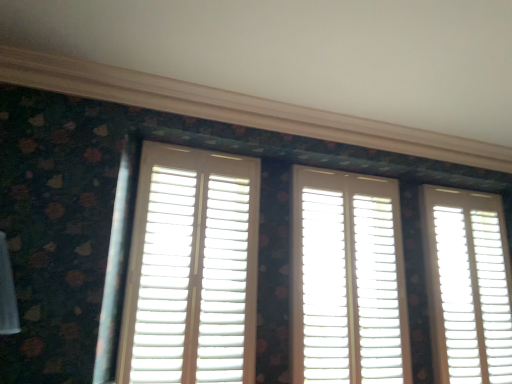
How much space does white wood shutters at center, marked as the 2th window in a right-to-left arrangement, occupy horizontally?

white wood shutters at center, marked as the 2th window in a right-to-left arrangement, is 6.44 inches wide.

Locate an element on the screen. The width and height of the screenshot is (512, 384). white wood shutters at center, marked as the 2th window in a right-to-left arrangement is located at coordinates (348, 280).

Locate an element on the screen. white matte shutters at center, which is the third window in right-to-left order is located at coordinates click(x=192, y=269).

Can you confirm if white matte shutter at right, the first window positioned from the right, is smaller than white matte shutters at center, which is the third window in right-to-left order?

No.

Is white matte shutter at right, acting as the 3th window starting from the left, behind white matte shutters at center, which is the third window in right-to-left order?

Yes.

Is point (454, 377) more distant than point (168, 298)?

Yes, it is.

You are a GUI agent. You are given a task and a screenshot of the screen. Output one action in this format:
    pyautogui.click(x=<x>, y=<y>)
    Task: Click on the window that is the 2nd one when counting backward from the white matte shutters at center, which is the third window in right-to-left order
    The image size is (512, 384).
    Given the screenshot: What is the action you would take?
    pyautogui.click(x=467, y=285)

Can you see white wood shutters at center, marked as the 2th window in a right-to-left arrangement, touching white matte shutter at right, acting as the 3th window starting from the left?

No, white wood shutters at center, marked as the 2th window in a right-to-left arrangement, is not beside white matte shutter at right, acting as the 3th window starting from the left.

Between point (369, 210) and point (502, 328), which one is positioned in front?

The point (369, 210) is in front.

Considering the relative positions of white wood shutters at center, the 2th window in the left-to-right sequence, and white matte shutter at right, the first window positioned from the right, in the image provided, is white wood shutters at center, the 2th window in the left-to-right sequence, to the left of white matte shutter at right, the first window positioned from the right, from the viewer's perspective?

Indeed, white wood shutters at center, the 2th window in the left-to-right sequence, is positioned on the left side of white matte shutter at right, the first window positioned from the right.

Is white wood shutters at center, the 2th window in the left-to-right sequence, aimed at white matte shutters at center, which is the third window in right-to-left order?

No, white wood shutters at center, the 2th window in the left-to-right sequence, does not turn towards white matte shutters at center, which is the third window in right-to-left order.

Which of these two, white wood shutters at center, marked as the 2th window in a right-to-left arrangement, or white matte shutters at center, marked as the first window in a left-to-right arrangement, is smaller?

With smaller size is white matte shutters at center, marked as the first window in a left-to-right arrangement.

How different are the orientations of white wood shutters at center, marked as the 2th window in a right-to-left arrangement, and white matte shutters at center, marked as the first window in a left-to-right arrangement, in degrees?

white wood shutters at center, marked as the 2th window in a right-to-left arrangement, and white matte shutters at center, marked as the first window in a left-to-right arrangement, are facing 2.49 degrees away from each other.

Is white wood shutters at center, marked as the 2th window in a right-to-left arrangement, in contact with white matte shutters at center, which is the third window in right-to-left order?

No, white wood shutters at center, marked as the 2th window in a right-to-left arrangement, is not making contact with white matte shutters at center, which is the third window in right-to-left order.

From the image's perspective, is white matte shutters at center, marked as the first window in a left-to-right arrangement, on top of white wood shutters at center, the 2th window in the left-to-right sequence?

Yes, from the image's perspective, white matte shutters at center, marked as the first window in a left-to-right arrangement, is above white wood shutters at center, the 2th window in the left-to-right sequence.

Looking at this image, could you measure the distance between white matte shutters at center, marked as the first window in a left-to-right arrangement, and white wood shutters at center, the 2th window in the left-to-right sequence?

white matte shutters at center, marked as the first window in a left-to-right arrangement, and white wood shutters at center, the 2th window in the left-to-right sequence, are 21.79 inches apart.

Is there a large distance between white matte shutters at center, which is the third window in right-to-left order, and white wood shutters at center, marked as the 2th window in a right-to-left arrangement?

No, white matte shutters at center, which is the third window in right-to-left order, is in close proximity to white wood shutters at center, marked as the 2th window in a right-to-left arrangement.

Is the depth of white matte shutters at center, marked as the first window in a left-to-right arrangement, greater than that of white wood shutters at center, the 2th window in the left-to-right sequence?

No, the depth of white matte shutters at center, marked as the first window in a left-to-right arrangement, is less than that of white wood shutters at center, the 2th window in the left-to-right sequence.

Is point (132, 282) positioned before point (443, 273)?

That is True.

Considering the sizes of objects white matte shutters at center, which is the third window in right-to-left order, and white matte shutter at right, acting as the 3th window starting from the left, in the image provided, who is shorter, white matte shutters at center, which is the third window in right-to-left order, or white matte shutter at right, acting as the 3th window starting from the left,?

white matte shutters at center, which is the third window in right-to-left order.

Is white matte shutters at center, marked as the first window in a left-to-right arrangement, oriented towards white matte shutter at right, the first window positioned from the right?

No, white matte shutters at center, marked as the first window in a left-to-right arrangement, is not turned towards white matte shutter at right, the first window positioned from the right.

From the image's perspective, is white matte shutter at right, the first window positioned from the right, located beneath white wood shutters at center, the 2th window in the left-to-right sequence?

Yes, from the image's perspective, white matte shutter at right, the first window positioned from the right, is beneath white wood shutters at center, the 2th window in the left-to-right sequence.

Is white matte shutter at right, acting as the 3th window starting from the left, far away from white wood shutters at center, marked as the 2th window in a right-to-left arrangement?

No, there isn't a large distance between white matte shutter at right, acting as the 3th window starting from the left, and white wood shutters at center, marked as the 2th window in a right-to-left arrangement.

Considering the relative sizes of white matte shutter at right, acting as the 3th window starting from the left, and white wood shutters at center, the 2th window in the left-to-right sequence, in the image provided, is white matte shutter at right, acting as the 3th window starting from the left, bigger than white wood shutters at center, the 2th window in the left-to-right sequence,?

No.

Looking at this image, considering the relative sizes of white matte shutter at right, acting as the 3th window starting from the left, and white wood shutters at center, marked as the 2th window in a right-to-left arrangement, in the image provided, is white matte shutter at right, acting as the 3th window starting from the left, wider than white wood shutters at center, marked as the 2th window in a right-to-left arrangement,?

No.

From a real-world perspective, starting from the white matte shutter at right, acting as the 3th window starting from the left, which window is the 2nd one vertically above it? Please provide its 2D coordinates.

[(192, 269)]

Locate an element on the screen. window below the white wood shutters at center, the 2th window in the left-to-right sequence (from the image's perspective) is located at coordinates (467, 285).

From the image, which object appears to be nearer to white matte shutters at center, marked as the first window in a left-to-right arrangement, white matte shutter at right, the first window positioned from the right, or white wood shutters at center, the 2th window in the left-to-right sequence?

white wood shutters at center, the 2th window in the left-to-right sequence, is closer to white matte shutters at center, marked as the first window in a left-to-right arrangement.

Considering their positions, is white wood shutters at center, the 2th window in the left-to-right sequence, positioned closer to white matte shutters at center, which is the third window in right-to-left order, than white matte shutter at right, the first window positioned from the right?

Among the two, white wood shutters at center, the 2th window in the left-to-right sequence, is located nearer to white matte shutters at center, which is the third window in right-to-left order.

Estimate the real-world distances between objects in this image. Which object is closer to white matte shutter at right, the first window positioned from the right, white matte shutters at center, marked as the first window in a left-to-right arrangement, or white wood shutters at center, marked as the 2th window in a right-to-left arrangement?

The object closer to white matte shutter at right, the first window positioned from the right, is white wood shutters at center, marked as the 2th window in a right-to-left arrangement.

Which object lies nearer to the anchor point white matte shutter at right, the first window positioned from the right, white wood shutters at center, marked as the 2th window in a right-to-left arrangement, or white matte shutters at center, which is the third window in right-to-left order?

white wood shutters at center, marked as the 2th window in a right-to-left arrangement, is closer to white matte shutter at right, the first window positioned from the right.

When comparing their distances from white wood shutters at center, the 2th window in the left-to-right sequence, does white matte shutter at right, acting as the 3th window starting from the left, or white matte shutters at center, which is the third window in right-to-left order, seem further?

white matte shutters at center, which is the third window in right-to-left order, lies further to white wood shutters at center, the 2th window in the left-to-right sequence, than the other object.

Considering their positions, is white matte shutters at center, marked as the first window in a left-to-right arrangement, positioned closer to white wood shutters at center, the 2th window in the left-to-right sequence, than white matte shutter at right, acting as the 3th window starting from the left?

white matte shutter at right, acting as the 3th window starting from the left.

Find the location of a particular element. Image resolution: width=512 pixels, height=384 pixels. window between white matte shutters at center, marked as the first window in a left-to-right arrangement, and white matte shutter at right, the first window positioned from the right, from left to right is located at coordinates (348, 280).